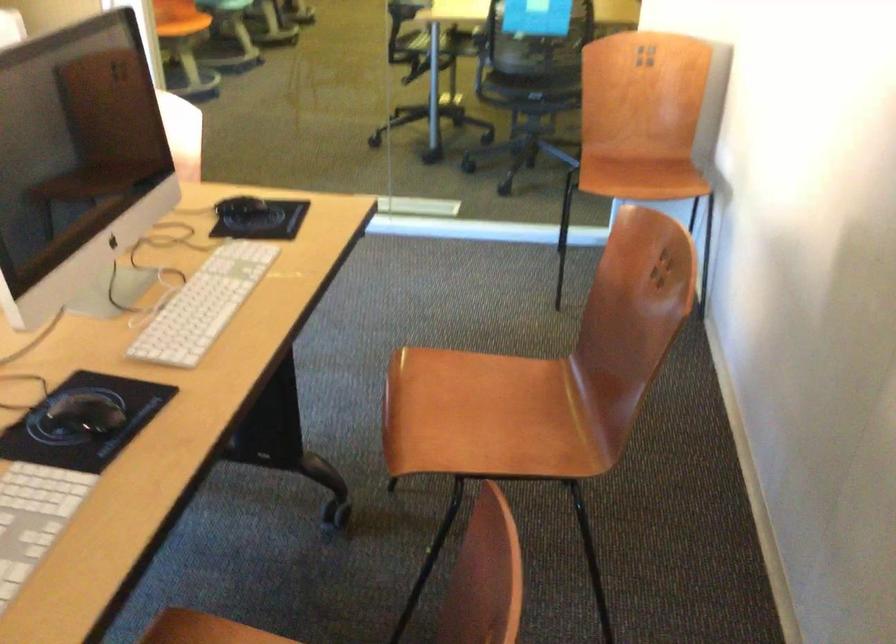
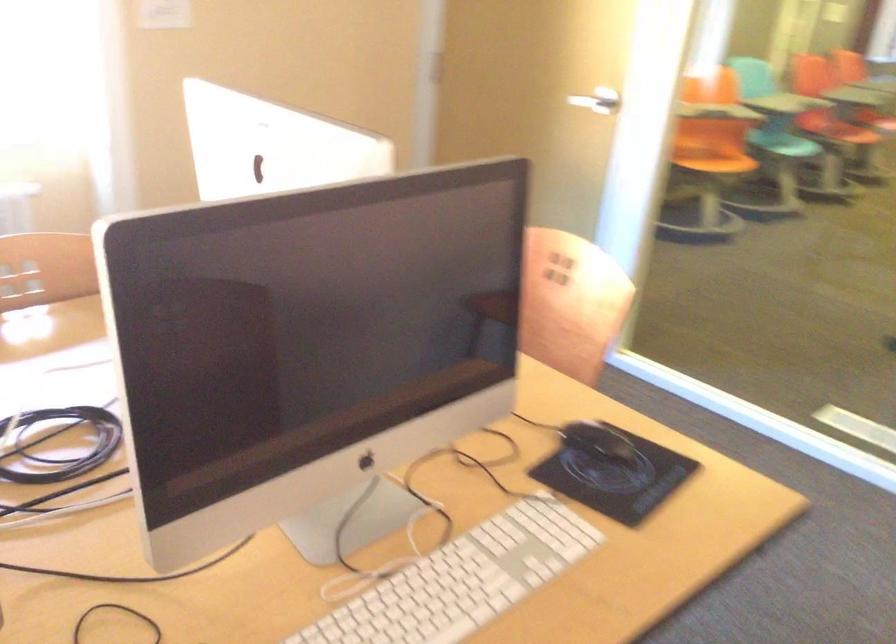
Question: How did the camera likely rotate?

Choices:
 (A) Left
 (B) Right
 (C) Up
 (D) Down

Answer: (A)